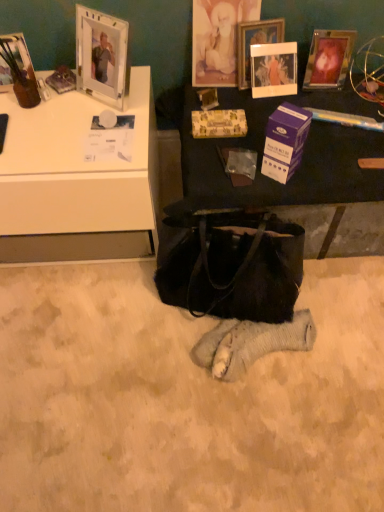
Where is `vacant area to the left of purple cardboard box at center`? This screenshot has width=384, height=512. vacant area to the left of purple cardboard box at center is located at coordinates (229, 167).